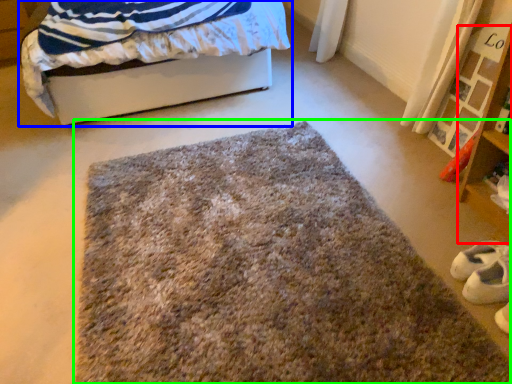
Question: Which object is the closest to the shelf (highlighted by a red box)? Choose among these: bed (highlighted by a blue box) or mat (highlighted by a green box).

Choices:
 (A) bed
 (B) mat

Answer: (B)